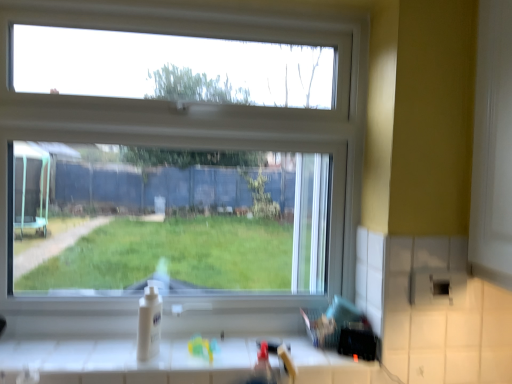
Locate an element on the screen. white glossy counter at lower center is located at coordinates (123, 362).

What do you see at coordinates (192, 135) in the screenshot? The height and width of the screenshot is (384, 512). I see `clear glass window at center` at bounding box center [192, 135].

The image size is (512, 384). Identify the location of white glossy counter at lower center. (123, 362).

Is the depth of clear glass window at center greater than that of white glossy sink at lower center?

Yes, it is.

Is clear glass window at center placed right next to white glossy sink at lower center?

No, clear glass window at center is not with white glossy sink at lower center.

Based on the photo, can we say clear glass window at center lies outside white glossy sink at lower center?

Yes, clear glass window at center is located beyond the bounds of white glossy sink at lower center.

How different are the orientations of clear glass window at center and white glossy sink at lower center in degrees?

There is a 4.8-degree angle between the facing directions of clear glass window at center and white glossy sink at lower center.

Does white glossy counter at lower center have a greater width compared to clear glass window at center?

Yes.

From the image's perspective, which is below, white glossy counter at lower center or clear glass window at center?

white glossy counter at lower center, from the image's perspective.

The width and height of the screenshot is (512, 384). Find the location of `counter on the right of the clear glass window at center`. counter on the right of the clear glass window at center is located at coordinates (123, 362).

Considering the positions of objects white glossy counter at lower center and clear glass window at center in the image provided, who is more to the right, white glossy counter at lower center or clear glass window at center?

Positioned to the right is white glossy counter at lower center.

In the image, there is a white glossy sink at lower center. Identify the location of counter below it (from the image's perspective). This screenshot has height=384, width=512. (123, 362).

Between white glossy counter at lower center and white glossy sink at lower center, which one appears on the right side from the viewer's perspective?

white glossy sink at lower center is more to the right.

Considering the sizes of objects white glossy counter at lower center and white glossy sink at lower center in the image provided, who is bigger, white glossy counter at lower center or white glossy sink at lower center?

With larger size is white glossy counter at lower center.

Is white glossy counter at lower center oriented towards white glossy sink at lower center?

No, white glossy counter at lower center does not turn towards white glossy sink at lower center.

Would you say clear glass window at center is inside or outside white glossy counter at lower center?

clear glass window at center is spatially situated outside white glossy counter at lower center.

Is clear glass window at center wider than white glossy counter at lower center?

No, clear glass window at center is not wider than white glossy counter at lower center.

Does point (165, 328) appear closer or farther from the camera than point (18, 347)?

Point (165, 328) is positioned farther from the camera compared to point (18, 347).

Is white glossy sink at lower center not near white glossy counter at lower center?

Actually, white glossy sink at lower center and white glossy counter at lower center are a little close together.

Can you confirm if white glossy sink at lower center is smaller than white glossy counter at lower center?

Yes, white glossy sink at lower center is smaller than white glossy counter at lower center.

From a real-world perspective, is white glossy sink at lower center beneath white glossy counter at lower center?

No, from a real-world perspective, white glossy sink at lower center is not under white glossy counter at lower center.

Is white glossy sink at lower center oriented away from white glossy counter at lower center?

No, white glossy sink at lower center is not facing away from white glossy counter at lower center.

Would you consider white glossy sink at lower center to be distant from clear glass window at center?

They are positioned close to each other.

Identify the location of sink directly beneath the clear glass window at center (from a real-world perspective). The height and width of the screenshot is (384, 512). (265, 364).

From a real-world perspective, between white glossy sink at lower center and clear glass window at center, who is vertically higher?

clear glass window at center, from a real-world perspective.

Where is `window behind the white glossy sink at lower center`? window behind the white glossy sink at lower center is located at coordinates tap(192, 135).

Identify the location of window above the white glossy counter at lower center (from the image's perspective). (192, 135).

Considering their positions, is white glossy sink at lower center positioned closer to clear glass window at center than white glossy counter at lower center?

white glossy counter at lower center.

Looking at the image, which one is located closer to white glossy counter at lower center, clear glass window at center or white glossy sink at lower center?

white glossy sink at lower center lies closer to white glossy counter at lower center than the other object.

Estimate the real-world distances between objects in this image. Which object is further from white glossy sink at lower center, clear glass window at center or white glossy counter at lower center?

The object further to white glossy sink at lower center is clear glass window at center.

When comparing their distances from clear glass window at center, does white glossy counter at lower center or white glossy sink at lower center seem closer?

white glossy counter at lower center is closer to clear glass window at center.

Considering their positions, is white glossy counter at lower center positioned closer to white glossy sink at lower center than clear glass window at center?

white glossy counter at lower center is positioned closer to the anchor white glossy sink at lower center.

Which object lies nearer to the anchor point white glossy counter at lower center, white glossy sink at lower center or clear glass window at center?

white glossy sink at lower center.

The image size is (512, 384). In order to click on sink that lies between clear glass window at center and white glossy counter at lower center from top to bottom in this screenshot , I will do `click(265, 364)`.